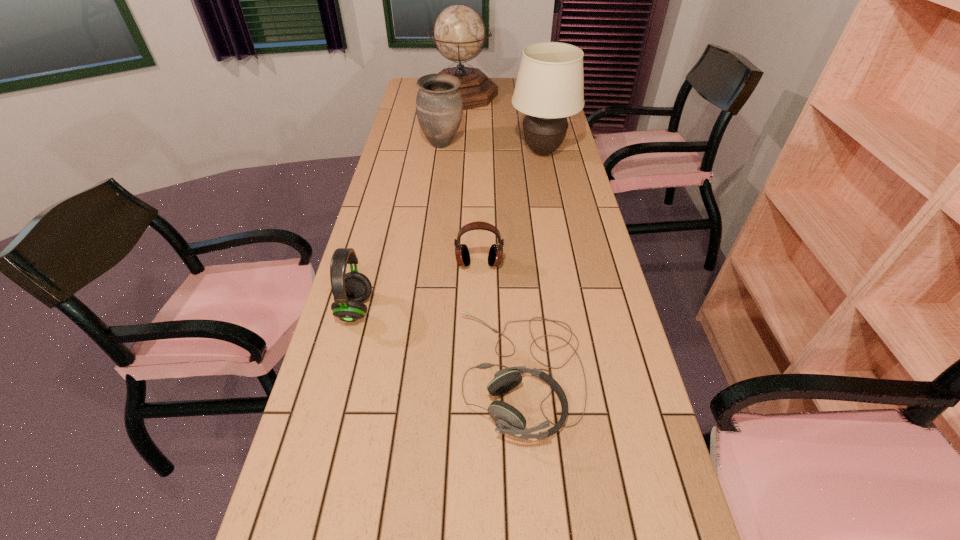
You are a GUI agent. You are given a task and a screenshot of the screen. Output one action in this format:
    pyautogui.click(x=<x>, y=<y>)
    Task: Click on the free point between the shortest headset and the lampshade
    Image resolution: width=960 pixels, height=540 pixels.
    Given the screenshot: What is the action you would take?
    pyautogui.click(x=531, y=262)

At what (x,y) coordinates should I click in order to perform the action: click on free spot between the lampshade and the third tallest object. Please return your answer as a coordinate pair (x, y). This screenshot has height=540, width=960. Looking at the image, I should click on (492, 148).

You are a GUI agent. You are given a task and a screenshot of the screen. Output one action in this format:
    pyautogui.click(x=<x>, y=<y>)
    Task: Click on the free spot between the lampshade and the second shortest headset
    This screenshot has height=540, width=960.
    Given the screenshot: What is the action you would take?
    pyautogui.click(x=511, y=208)

Where is `object that is the fourth closest one to the third nearest object`? Image resolution: width=960 pixels, height=540 pixels. object that is the fourth closest one to the third nearest object is located at coordinates (439, 107).

Identify which object is the fourth closest to the second tallest headset. Please provide its 2D coordinates. Your answer should be formatted as a tuple, i.e. [(x, y)], where the tuple contains the x and y coordinates of a point satisfying the conditions above.

[(439, 107)]

The width and height of the screenshot is (960, 540). I want to click on the closest headset to the second shortest object, so click(x=508, y=420).

Point out which headset is positioned as the second nearest to the farthest object. Please provide its 2D coordinates. Your answer should be formatted as a tuple, i.e. [(x, y)], where the tuple contains the x and y coordinates of a point satisfying the conditions above.

[(350, 289)]